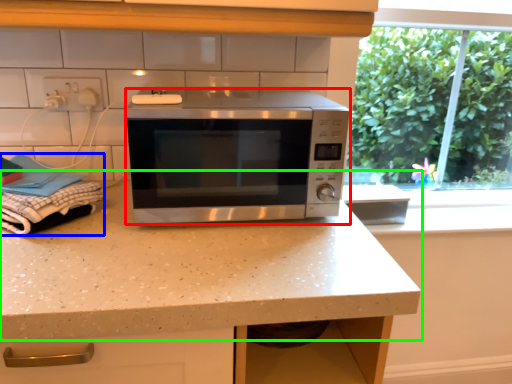
Question: Estimate the real-world distances between objects in this image. Which object is closer to microwave oven (highlighted by a red box), laundry (highlighted by a blue box) or countertop (highlighted by a green box)?

Choices:
 (A) laundry
 (B) countertop

Answer: (B)